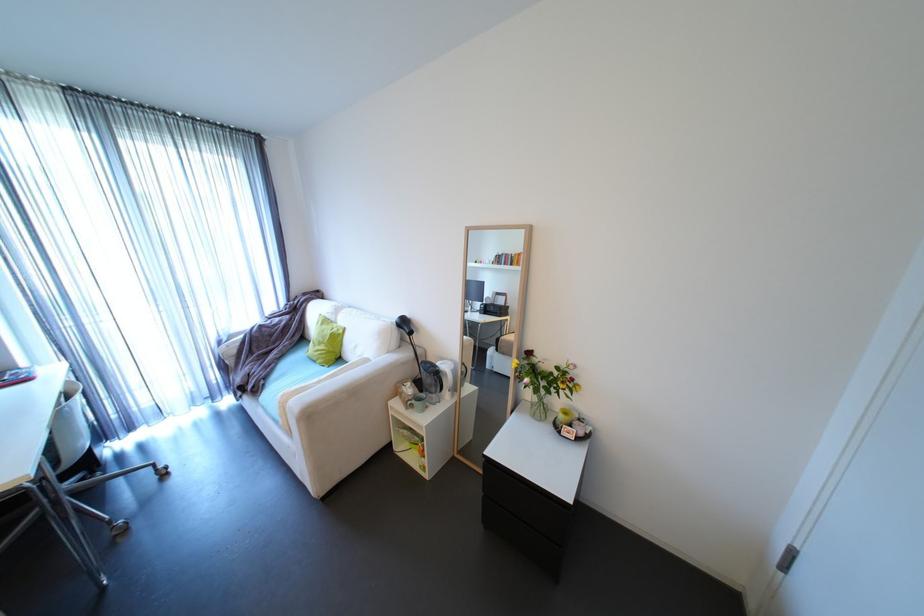
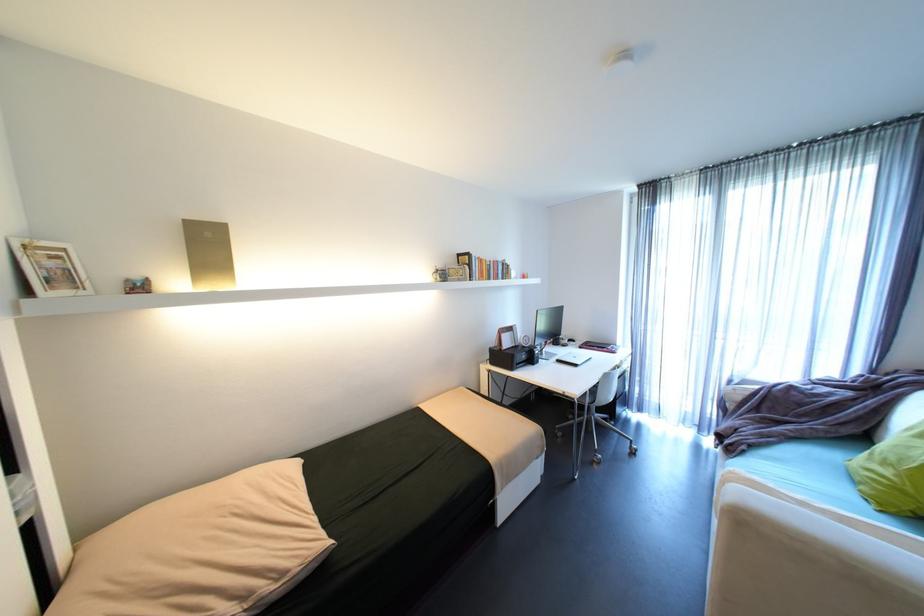
Find the pixel in the second image that matches pixel 333 346 in the first image.

(906, 476)